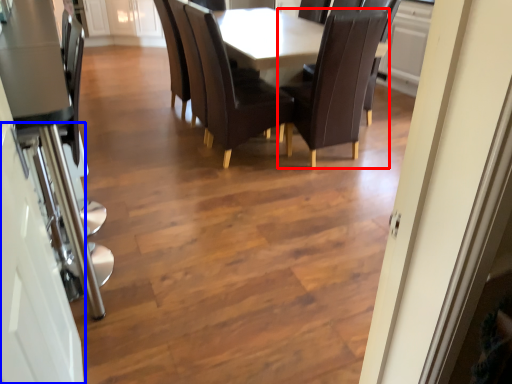
Question: Which point is further to the camera, chair (highlighted by a red box) or glass door (highlighted by a blue box)?

Choices:
 (A) chair
 (B) glass door

Answer: (A)